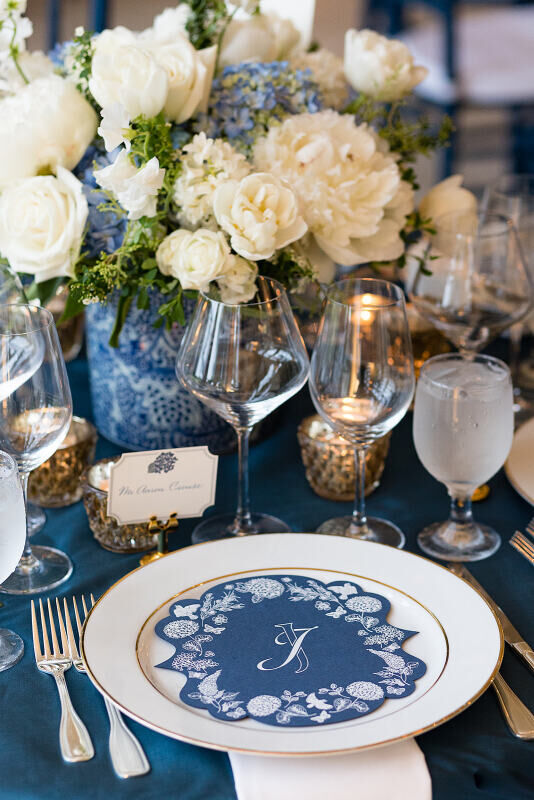
The width and height of the screenshot is (534, 800). Identify the location of vase. (128, 362).